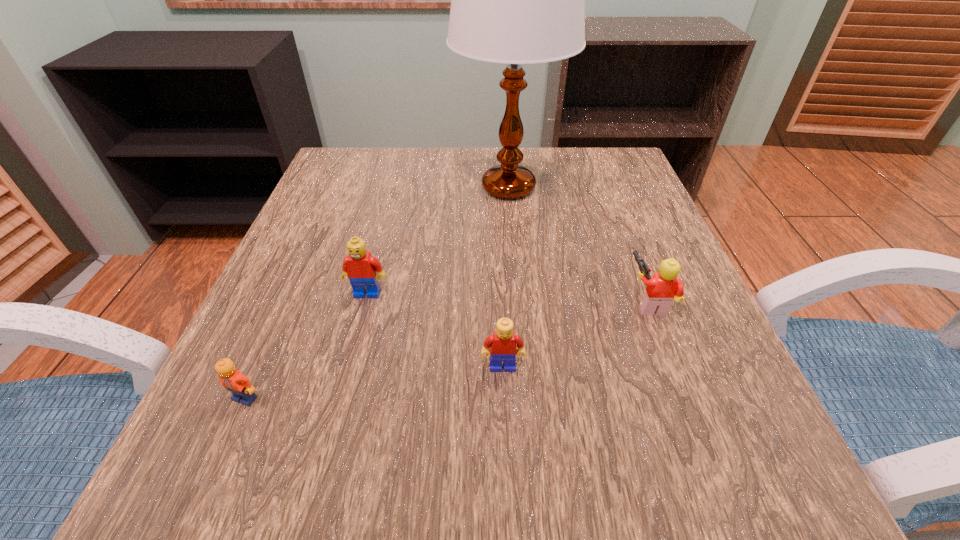
This screenshot has width=960, height=540. I want to click on vacant region located 0.140m in front of the rightmost Lego with the accessory visible, so click(545, 302).

The width and height of the screenshot is (960, 540). What are the coordinates of `vacant space located 0.290m in front of the rightmost Lego with the accessory visible` in the screenshot? It's located at (457, 302).

Locate an element on the screen. The image size is (960, 540). free location located 0.060m in front of the rightmost Lego with the accessory visible is located at coordinates (593, 302).

Identify the location of free region located on the face of the third farthest Lego. This screenshot has width=960, height=540. (508, 478).

Where is `free location located 0.120m on the front-facing side of the shortest object`? This screenshot has width=960, height=540. free location located 0.120m on the front-facing side of the shortest object is located at coordinates (201, 500).

Find the location of `object present at the far edge`. object present at the far edge is located at coordinates (516, 0).

The image size is (960, 540). Identify the location of object present at the right edge. pos(664,287).

Where is `vacant space at the far edge`? vacant space at the far edge is located at coordinates (459, 173).

Identify the location of vacant area at the near edge. (532, 460).

Find the location of a particular element. blank area at the left edge is located at coordinates (251, 353).